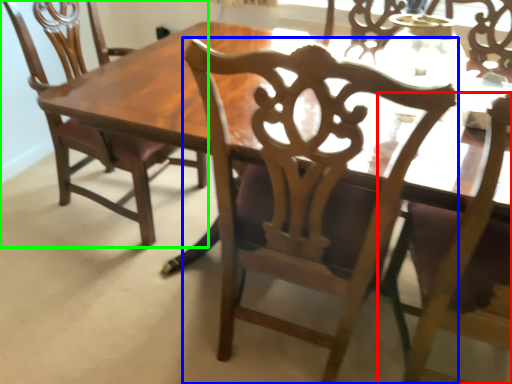
Question: Based on their relative distances, which object is farther from chair (highlighted by a red box)? Choose from chair (highlighted by a blue box) and chair (highlighted by a green box).

Choices:
 (A) chair
 (B) chair

Answer: (B)